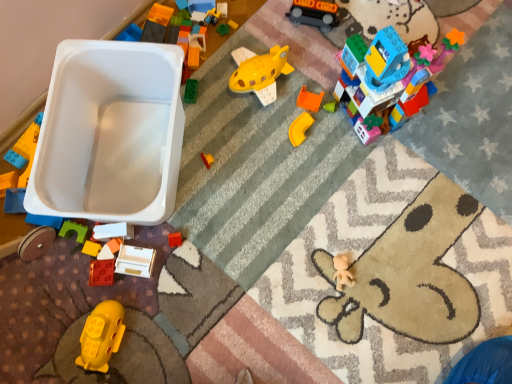
The image size is (512, 384). Identify the location of free space to the left of matte white drawer at lower center, which ranks as the third toy in bottom-to-top order. (73, 281).